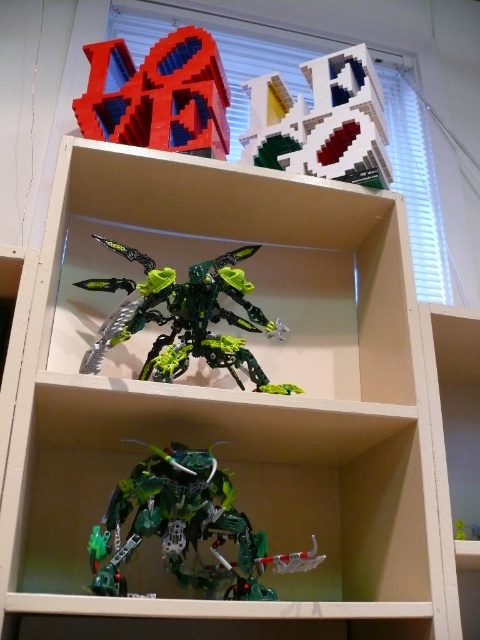
From the picture: Which is more to the right, translucent green plastic robot at center or green matte insect at center?

From the viewer's perspective, translucent green plastic robot at center appears more on the right side.

Can you confirm if translucent green plastic robot at center is wider than green matte insect at center?

No, translucent green plastic robot at center is not wider than green matte insect at center.

Which is behind, point (223, 534) or point (213, 304)?

Point (213, 304)

Where is `translucent green plastic robot at center`? The width and height of the screenshot is (480, 640). translucent green plastic robot at center is located at coordinates (186, 525).

Between point (216, 522) and point (280, 161), which one is positioned in front?

Point (216, 522) is in front.

Based on the photo, can you confirm if translucent green plastic robot at center is positioned to the right of white plastic blocks at upper center?

In fact, translucent green plastic robot at center is to the left of white plastic blocks at upper center.

You are a GUI agent. You are given a task and a screenshot of the screen. Output one action in this format:
    pyautogui.click(x=<x>, y=<y>)
    Task: Click on the translucent green plastic robot at center
    
    Given the screenshot: What is the action you would take?
    pyautogui.click(x=186, y=525)

Who is more distant from viewer, (x=211, y=280) or (x=205, y=134)?

The point (x=205, y=134) is more distant.

Find the location of a particular element. The height and width of the screenshot is (640, 480). green matte insect at center is located at coordinates (186, 317).